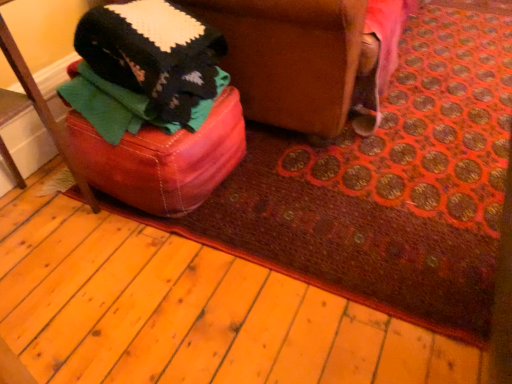
Question: Is point (385, 28) closer or farther from the camera than point (3, 31)?

Choices:
 (A) farther
 (B) closer

Answer: (A)

Question: From the image's perspective, is leather ottoman at lower left positioned above or below leather ottoman at left?

Choices:
 (A) above
 (B) below

Answer: (A)

Question: Is leather ottoman at lower left taller or shorter than leather ottoman at left?

Choices:
 (A) tall
 (B) short

Answer: (B)

Question: Considering the positions of leather ottoman at left and leather ottoman at lower left in the image, is leather ottoman at left bigger or smaller than leather ottoman at lower left?

Choices:
 (A) big
 (B) small

Answer: (B)

Question: Is point (41, 120) positioned closer to the camera than point (257, 43)?

Choices:
 (A) closer
 (B) farther

Answer: (A)

Question: In terms of width, does leather ottoman at left look wider or thinner when compared to leather ottoman at lower left?

Choices:
 (A) thin
 (B) wide

Answer: (A)

Question: Do you think leather ottoman at left is within leather ottoman at lower left, or outside of it?

Choices:
 (A) outside
 (B) inside

Answer: (A)